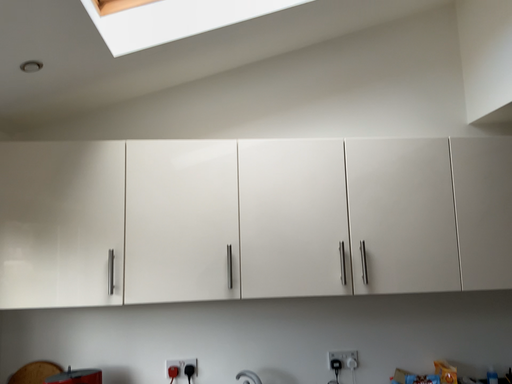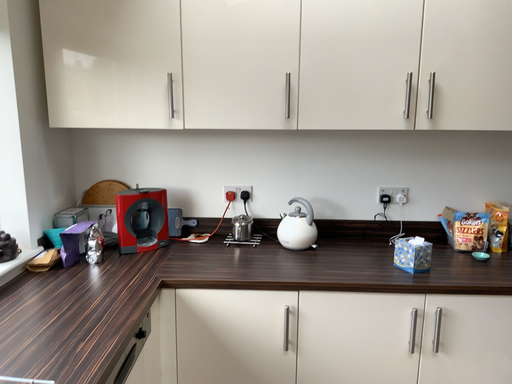
Question: Which way did the camera rotate in the video?

Choices:
 (A) rotated downward
 (B) rotated upward

Answer: (A)